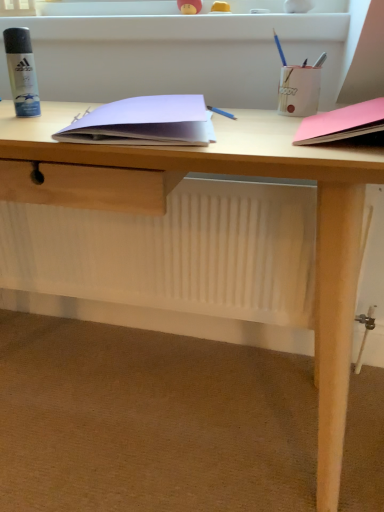
Question: In terms of width, does matte white pencil holder at upper right, the 2th stationery in the right-to-left sequence, look wider or thinner when compared to pink matte paper at right, acting as the 1th paperback book starting from the right?

Choices:
 (A) wide
 (B) thin

Answer: (B)

Question: From their relative heights in the image, would you say matte white pencil holder at upper right, the 3th stationery from the left, is taller or shorter than pink matte paper at right, acting as the 1th paperback book starting from the right?

Choices:
 (A) tall
 (B) short

Answer: (A)

Question: Which of these objects is positioned closest to the matte white pencil holder at upper right, the 2th stationery in the right-to-left sequence?

Choices:
 (A) white paper at center, arranged as the first paperback book when viewed from the left
 (B) metallic silver pen at upper right, the fourth stationery positioned from the left
 (C) blue pencil at upper right, placed as the 3th stationery when sorted from right to left
 (D) matte black spray can at left, which is counted as the 4th stationery, starting from the right
 (E) pink matte paper at right, the second paperback book when ordered from left to right

Answer: (B)

Question: Estimate the real-world distances between objects in this image. Which object is farther from the matte white pencil holder at upper right, the 3th stationery from the left?

Choices:
 (A) pink matte paper at right, acting as the 1th paperback book starting from the right
 (B) blue pencil at upper right, the 2th stationery in the left-to-right sequence
 (C) white paper at center, arranged as the first paperback book when viewed from the left
 (D) matte black spray can at left, which is counted as the 4th stationery, starting from the right
 (E) metallic silver pen at upper right, the fourth stationery positioned from the left

Answer: (D)